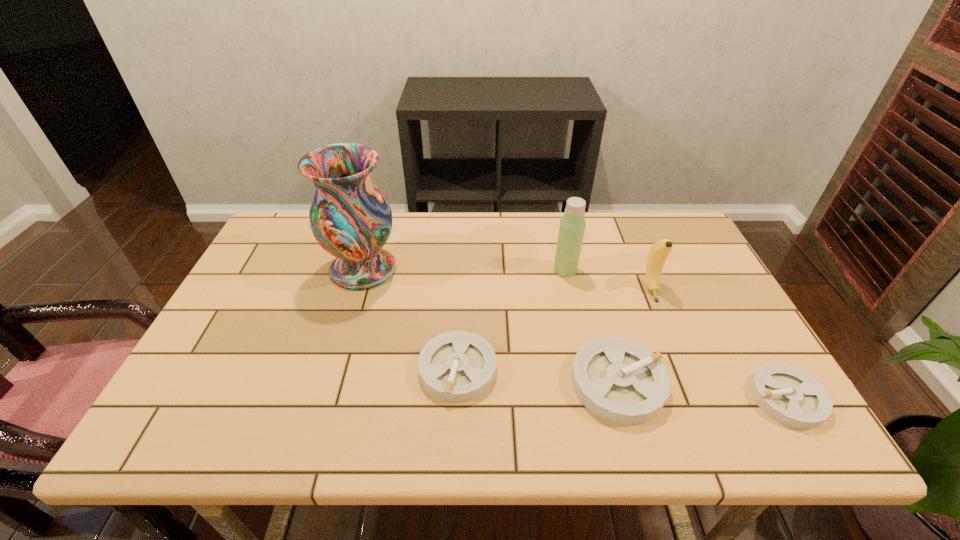
Find the location of a particular element. vacant area in the image that satisfies the following two spatial constraints: 1. on the back side of the second tallest ashtray; 2. on the left side of the second tallest object is located at coordinates (463, 269).

This screenshot has height=540, width=960. Find the location of `free spot that satisfies the following two spatial constraints: 1. on the front side of the tallest object; 2. on the right side of the leftmost ashtray`. free spot that satisfies the following two spatial constraints: 1. on the front side of the tallest object; 2. on the right side of the leftmost ashtray is located at coordinates (333, 369).

I want to click on vacant space that satisfies the following two spatial constraints: 1. on the front side of the fifth tallest object; 2. on the left side of the rightmost object, so click(x=456, y=399).

Where is `vacant area in the image that satisfies the following two spatial constraints: 1. on the front side of the second ashtray from left to right; 2. on the left side of the vase`? The image size is (960, 540). vacant area in the image that satisfies the following two spatial constraints: 1. on the front side of the second ashtray from left to right; 2. on the left side of the vase is located at coordinates (328, 383).